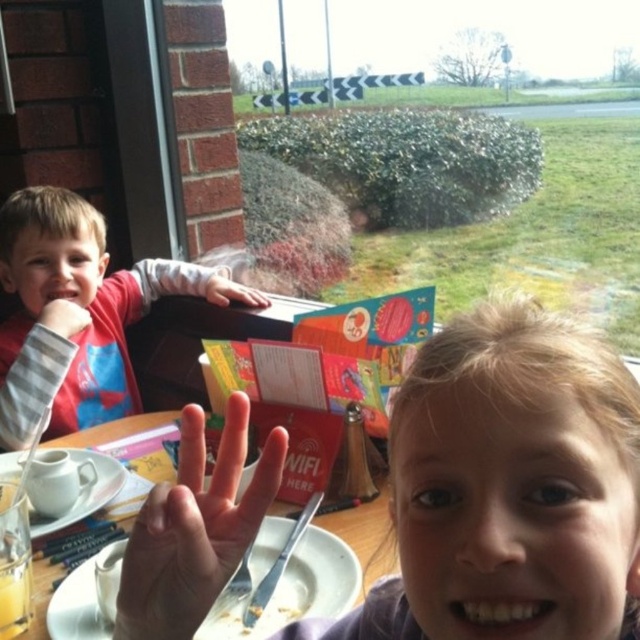
Question: Which of the following is the farthest from the observer?

Choices:
 (A) (358, 552)
 (B) (480, 321)
 (C) (68, 378)
 (D) (241, 292)

Answer: (D)

Question: Can you confirm if matte red shirt at left is smaller than white glossy plate at center?

Choices:
 (A) no
 (B) yes

Answer: (A)

Question: Is blonde hair girl at center above white ceramic plate at lower left?

Choices:
 (A) yes
 (B) no

Answer: (A)

Question: Which object is closer to the camera taking this photo?

Choices:
 (A) smooth gray wristband at left
 (B) matte red shirt at left
 (C) smooth skin hand at upper left
 (D) blonde hair girl at center

Answer: (D)

Question: Where is white glossy plate at center located in relation to smooth skin hand at upper left in the image?

Choices:
 (A) right
 (B) left

Answer: (A)

Question: Among these points, which one is nearest to the camera?

Choices:
 (A) (356, 518)
 (B) (228, 304)

Answer: (A)